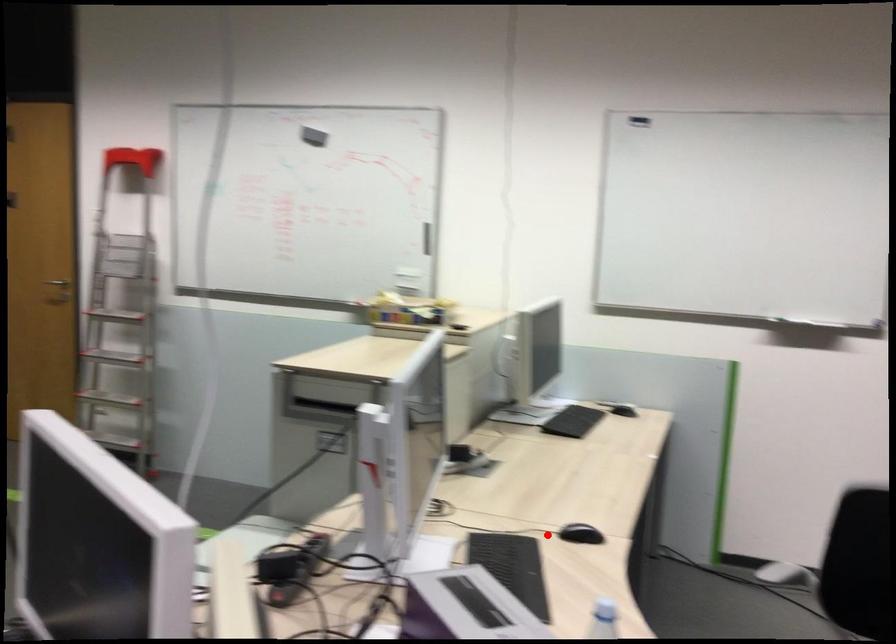
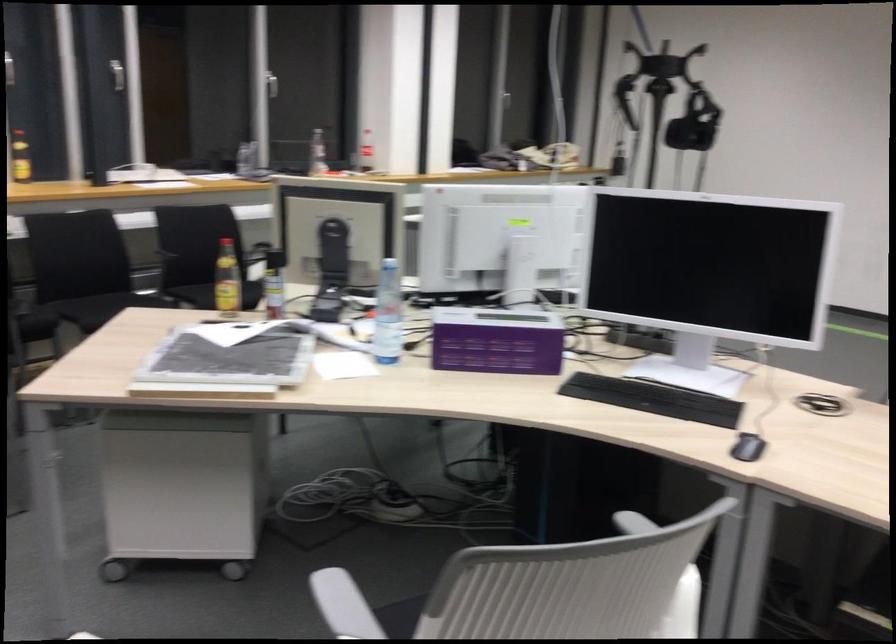
Question: A red point is marked in image1. In image2, is the corresponding 3D point closer to the camera or farther? Reply with the corresponding letter.

Choices:
 (A) The corresponding 3D point is closer.
 (B) The corresponding 3D point is farther.

Answer: (A)